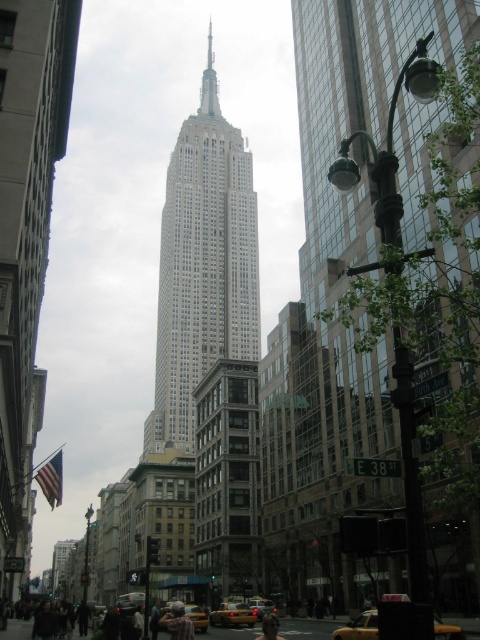
You are a photographer standing on Fifth Avenue, trying to capture a photo of the white smooth skyscraper at center and the yellow rubber taxi at center. Since you want both subjects to appear proportionally sized in your shot, which object should you move closer to, and why?

You should move closer to the yellow rubber taxi at center because the white smooth skyscraper at center is wider than the yellow rubber taxi at center. By moving closer to the smaller object, you can balance their sizes in the photo.

You are standing on the street and looking at the white smooth skyscraper at center and the yellow rubber taxi at center. Which object is closer to you?

The white smooth skyscraper at center is closer to you because it is positioned further to the viewer than the yellow rubber taxi at center, meaning it appears nearer in the visual perspective.

You are a photographer standing at the street corner. You want to capture both the yellow matte taxi at center and the yellow matte taxi at lower center in a single shot. Which taxi should you position closer to the camera to ensure both are fully visible in the frame?

The yellow matte taxi at lower center should be positioned closer to the camera because its actual width is smaller than the yellow matte taxi at center. By placing the smaller taxi closer, their apparent sizes in the photo will be more balanced, allowing both to fit better in the frame.